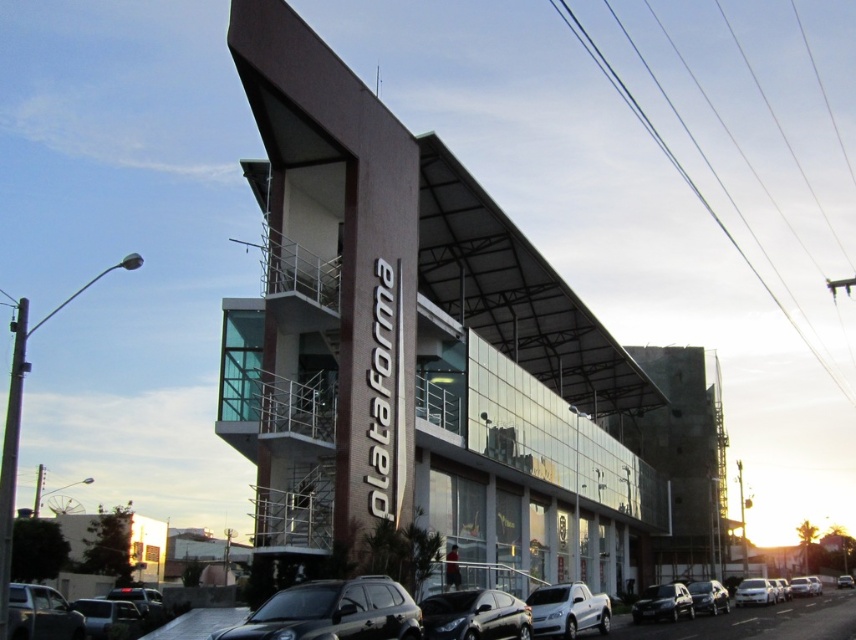
You are a delivery driver approaching the modern building with a distinctive architectural design. You need to park your vehicle near the entrance. Is the satin black suv at lower center blocking your path to the entrance?

The satin black suv at lower center is located at point (331, 612), which does not provide information about its position relative to the entrance. Therefore, it is unclear if it is blocking your path.

You are a delivery person trying to park your van between the satin black car at lower center and the silver metallic car at lower left. Can you fit your van if it requires 2 meters of space between the two cars?

The satin black car at lower center is above the silver metallic car at lower left, which means they are not aligned horizontally. Therefore, there is no direct space between them for the van to park.

You are a parking attendant and need to fit both the shiny black sedan at lower center and the shiny silver sedan at center into a parking spot that can only accommodate one car. Which car should you choose to park?

The shiny black sedan at lower center is larger in size than the shiny silver sedan at center, so the shiny silver sedan at center can fit into the parking spot while the larger one cannot.